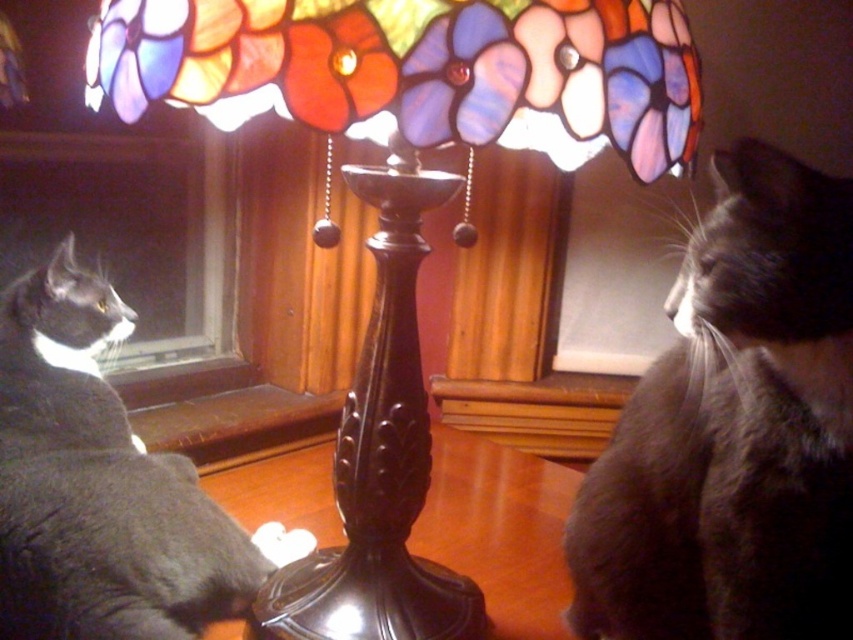
Is stained glass lampshade at center positioned behind black polished wood table at center?

No.

Does stained glass lampshade at center have a greater width compared to black polished wood table at center?

Incorrect, stained glass lampshade at center's width does not surpass black polished wood table at center's.

Image resolution: width=853 pixels, height=640 pixels. I want to click on stained glass lampshade at center, so click(x=416, y=77).

At what (x,y) coordinates should I click in order to perform the action: click on stained glass lampshade at center. Please return your answer as a coordinate pair (x, y). The image size is (853, 640). Looking at the image, I should click on (416, 77).

Which is below, stained glass lampshade at center or gray fur cat at left?

gray fur cat at left

Is point (302, 632) in front of point (142, 572)?

No.

Is point (393, 476) positioned after point (73, 605)?

Yes, point (393, 476) is farther from viewer.

This screenshot has width=853, height=640. Find the location of `stained glass lampshade at center`. stained glass lampshade at center is located at coordinates (416, 77).

Is gray fur cat at upper right further to camera compared to black polished wood table at center?

No, gray fur cat at upper right is closer to the viewer.

The width and height of the screenshot is (853, 640). Identify the location of gray fur cat at upper right. (734, 432).